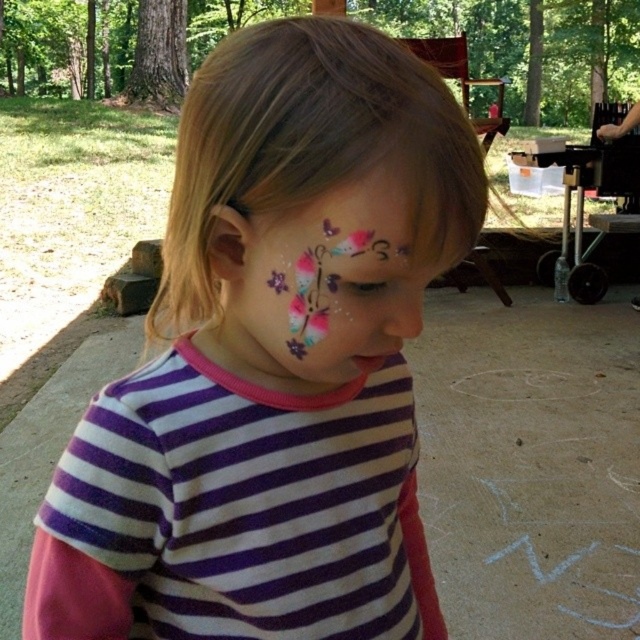
What is located at the coordinates point [272,362]?

The point [272,362] is on matte white face paint at center.

You are a makeup artist preparing to apply a matte pink nose at center on a child who already has matte white face paint at center. Based on the scene, will the new application interfere with the existing face paint?

The matte white face paint at center and matte pink nose at center are 6.67 inches apart from each other, so the new application will not interfere with the existing face paint.

You are a makeup artist preparing to apply face paint on a child. You have a brush that is 2 inches long. If you want to paint the pastel glitter butterflies at center without moving your hand, can you reach the matte pink nose at center with the same brush?

The distance between the pastel glitter butterflies at center and the matte pink nose at center is 2.17 inches. Since the brush is only 2 inches long, it is slightly shorter than the distance required. Therefore, you would not be able to reach the matte pink nose at center with the same brush without moving your hand.